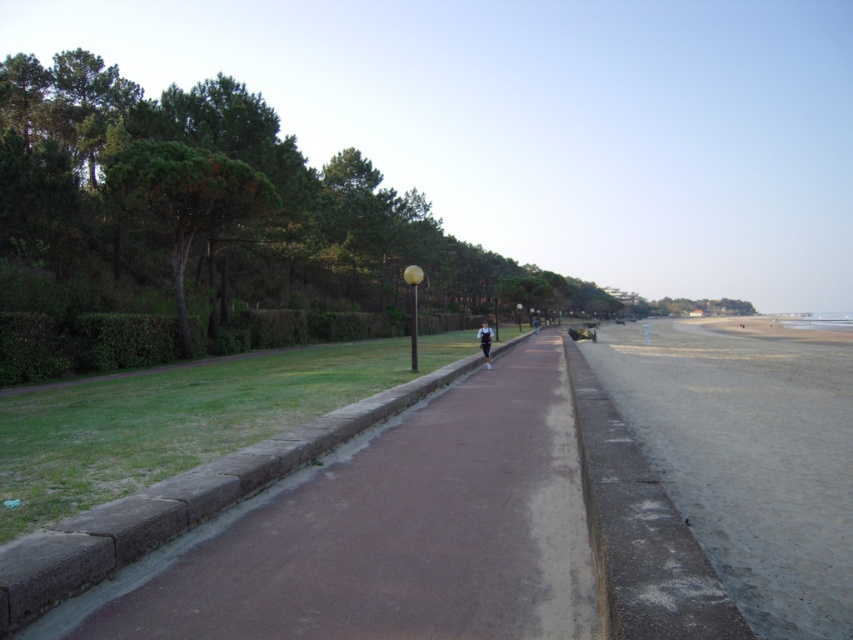
Between gray sand at lower right and gray concrete curb at center, which one has less height?

gray concrete curb at center is shorter.

Which is below, gray sand at lower right or gray concrete curb at center?

gray concrete curb at center is below.

Does point (814, 339) come in front of point (231, 497)?

No, it is behind (231, 497).

Locate an element on the screen. gray sand at lower right is located at coordinates (747, 456).

Consider the image. Can you confirm if gray sand at lower right is positioned to the right of light blue fabric jacket at center?

Yes, gray sand at lower right is to the right of light blue fabric jacket at center.

Can you confirm if gray sand at lower right is thinner than light blue fabric jacket at center?

Incorrect, gray sand at lower right's width is not less than light blue fabric jacket at center's.

Where is `gray sand at lower right`? The image size is (853, 640). gray sand at lower right is located at coordinates (747, 456).

This screenshot has height=640, width=853. Find the location of `gray sand at lower right`. gray sand at lower right is located at coordinates (747, 456).

From the picture: Is gray concrete curb at center above light blue fabric jacket at center?

No.

Can you confirm if gray concrete curb at center is bigger than light blue fabric jacket at center?

No, gray concrete curb at center is not bigger than light blue fabric jacket at center.

Who is more forward, (x=65, y=557) or (x=490, y=340)?

Point (x=65, y=557)

Where is `gray concrete curb at center`? The height and width of the screenshot is (640, 853). gray concrete curb at center is located at coordinates (181, 502).